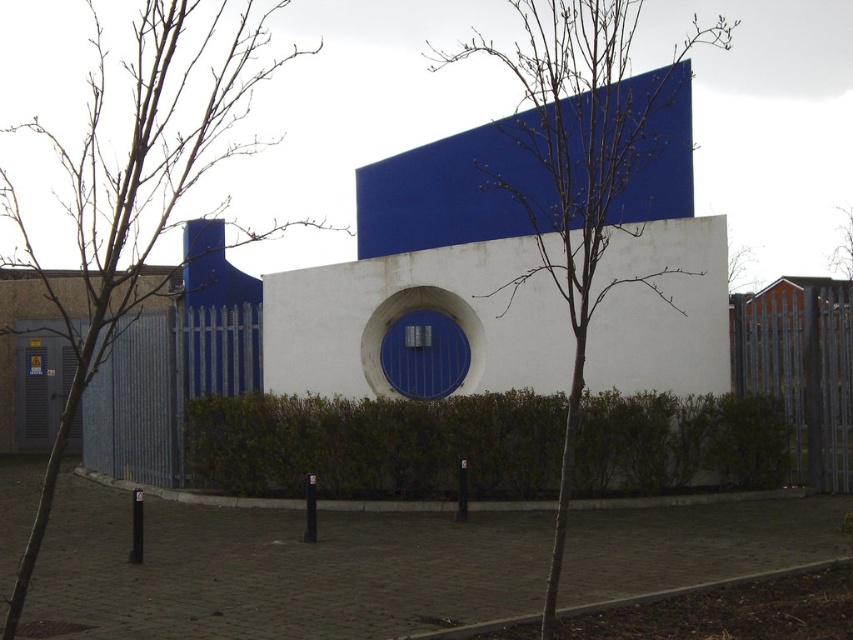
Is blue corrugated metal chapel at left to the left of bare branches at upper right from the viewer's perspective?

Correct, you'll find blue corrugated metal chapel at left to the left of bare branches at upper right.

The image size is (853, 640). Identify the location of blue corrugated metal chapel at left. (212, 308).

Is blue matte wall at center to the right of bare branches at upper right from the viewer's perspective?

In fact, blue matte wall at center is to the left of bare branches at upper right.

Can you confirm if blue matte wall at center is bigger than bare branches at upper right?

Incorrect, blue matte wall at center is not larger than bare branches at upper right.

What do you see at coordinates (426, 276) in the screenshot? This screenshot has width=853, height=640. I see `blue matte wall at center` at bounding box center [426, 276].

Identify the location of blue matte wall at center. (426, 276).

Does blue matte wall at center have a smaller size compared to blue corrugated metal chapel at left?

Indeed, blue matte wall at center has a smaller size compared to blue corrugated metal chapel at left.

Is point (625, 289) positioned in front of point (189, 259)?

No, (625, 289) is behind (189, 259).

At what (x,y) coordinates should I click in order to perform the action: click on blue matte wall at center. Please return your answer as a coordinate pair (x, y). The width and height of the screenshot is (853, 640). Looking at the image, I should click on (426, 276).